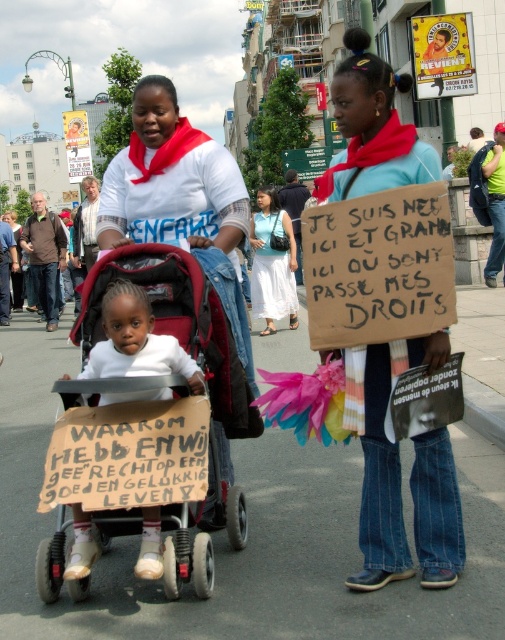
You are a photographer trying to capture a clear photo of the blue denim jeans at center and the matte plastic baby carriage at center. Based on their positions, which object should you focus on first to ensure both are in focus?

The blue denim jeans at center is closer to the viewer than the matte plastic baby carriage at center. To ensure both are in focus, focus on the blue denim jeans at center first since it is the closer object.

You are a photographer trying to capture the protest scene. You want to ensure that the matte plastic baby carriage at center is in the frame. Based on its position at point coordinates, where should you position your camera relative to the carriage?

The matte plastic baby carriage at center is located at coordinates point (184, 348), so you should position your camera to the right and slightly above the carriage to include it in the frame.

You are a photographer standing at the edge of the protest. You need to capture a photo that includes both the blue denim jeans at center and the white cotton dress at center. What is the minimum distance you should position yourself from the closer object to ensure both are in frame?

The blue denim jeans at center and the white cotton dress at center are 4.35 meters apart. To include both in the photo, you should position yourself at least 4.35 meters away from the closer object so that the entire distance between them fits within the camera frame.